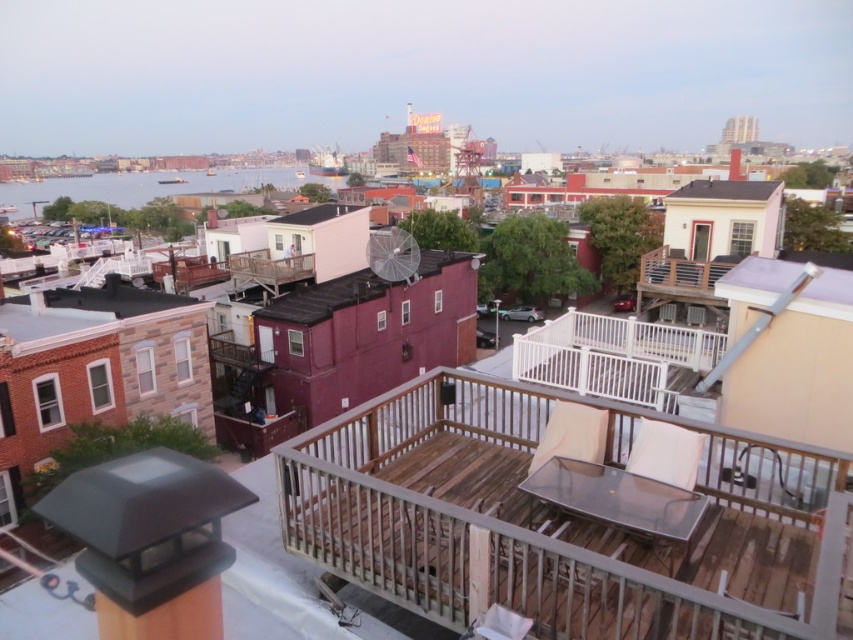
From the picture: How much distance is there between brown wooden deck at center and white wood balcony at center?

The distance of brown wooden deck at center from white wood balcony at center is 8.47 meters.

Identify the location of brown wooden deck at center. (564, 518).

Where is `brown wooden deck at center`? The height and width of the screenshot is (640, 853). brown wooden deck at center is located at coordinates (564, 518).

Looking at this image, how much distance is there between brown wooden deck at center and blue water at left?

The distance of brown wooden deck at center from blue water at left is 207.07 meters.

Is brown wooden deck at center to the left of blue water at left from the viewer's perspective?

No, brown wooden deck at center is not to the left of blue water at left.

At what (x,y) coordinates should I click in order to perform the action: click on brown wooden deck at center. Please return your answer as a coordinate pair (x, y). The width and height of the screenshot is (853, 640). Looking at the image, I should click on (564, 518).

At what (x,y) coordinates should I click in order to perform the action: click on brown wooden deck at center. Please return your answer as a coordinate pair (x, y). Looking at the image, I should click on [564, 518].

Between white wood balcony at center and blue water at left, which one appears on the right side from the viewer's perspective?

white wood balcony at center

What are the coordinates of `white wood balcony at center` in the screenshot? It's located at (614, 356).

Between point (524, 346) and point (285, 173), which one is positioned in front?

Point (524, 346) is in front.

Identify the location of white wood balcony at center. This screenshot has width=853, height=640. (614, 356).